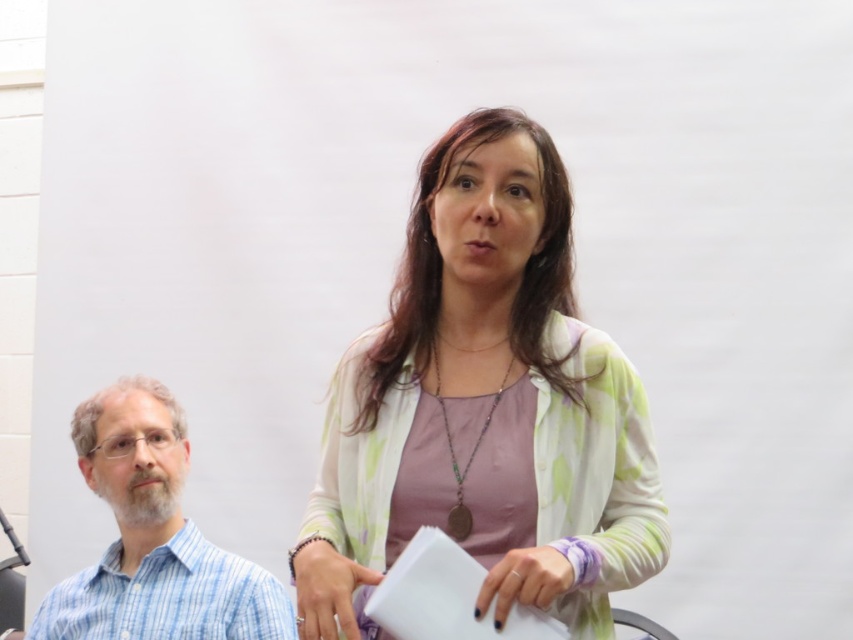
Question: Considering the relative positions of pastel floral cardigan at center and blue striped shirt at left in the image provided, where is pastel floral cardigan at center located with respect to blue striped shirt at left?

Choices:
 (A) right
 (B) left

Answer: (A)

Question: Does pastel floral cardigan at center have a lesser width compared to blue striped shirt at left?

Choices:
 (A) yes
 (B) no

Answer: (A)

Question: Is pastel floral cardigan at center to the right of blue striped shirt at left from the viewer's perspective?

Choices:
 (A) no
 (B) yes

Answer: (B)

Question: Which point appears closest to the camera in this image?

Choices:
 (A) (78, 436)
 (B) (624, 572)

Answer: (B)

Question: Which point appears closest to the camera in this image?

Choices:
 (A) (164, 524)
 (B) (370, 547)

Answer: (B)

Question: Which of the following is the closest to the observer?

Choices:
 (A) blue striped shirt at left
 (B) pastel floral cardigan at center

Answer: (B)